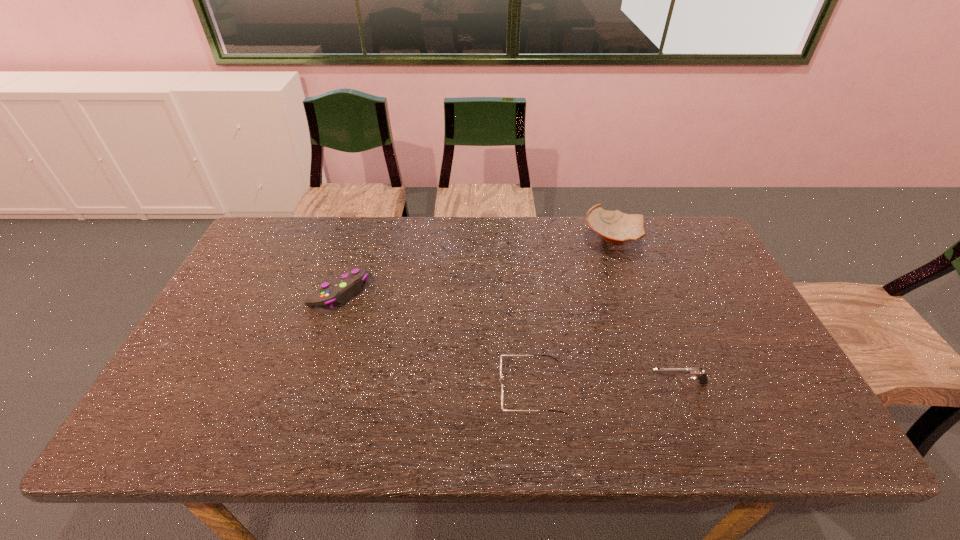
Where is `the tallest object`? The image size is (960, 540). the tallest object is located at coordinates (615, 227).

What are the coordinates of `pottery` in the screenshot? It's located at (615, 227).

Where is `control`? The width and height of the screenshot is (960, 540). control is located at coordinates (340, 290).

At what (x,y) coordinates should I click in order to perform the action: click on the second farthest object. Please return your answer as a coordinate pair (x, y). This screenshot has width=960, height=540. Looking at the image, I should click on (340, 290).

At what (x,y) coordinates should I click in order to perform the action: click on pistol. Please return your answer as a coordinate pair (x, y). The height and width of the screenshot is (540, 960). Looking at the image, I should click on (697, 372).

The image size is (960, 540). I want to click on the third object from right to left, so click(501, 356).

Identify the location of vacant space located on the front of the pottery. (627, 280).

Identify the location of blank space located on the left of the control. (273, 292).

The height and width of the screenshot is (540, 960). In order to click on vacant region located on the front-facing side of the pistol in this screenshot , I will do `click(622, 383)`.

Locate an element on the screen. vacant space situated 0.260m on the front-facing side of the pistol is located at coordinates (539, 383).